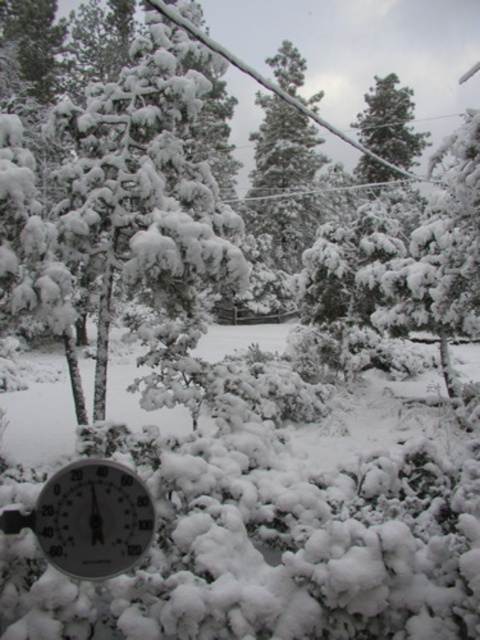
Question: Among these points, which one is farthest from the camera?

Choices:
 (A) (91, 544)
 (B) (265, 218)

Answer: (B)

Question: In this image, where is transparent glass thermometer at lower left located relative to snow-covered evergreen tree at center?

Choices:
 (A) left
 (B) right

Answer: (A)

Question: Can you confirm if transparent glass thermometer at lower left is thinner than snow-covered evergreen tree at center?

Choices:
 (A) yes
 (B) no

Answer: (A)

Question: Is transparent glass thermometer at lower left positioned in front of snow-covered evergreen tree at center?

Choices:
 (A) no
 (B) yes

Answer: (B)